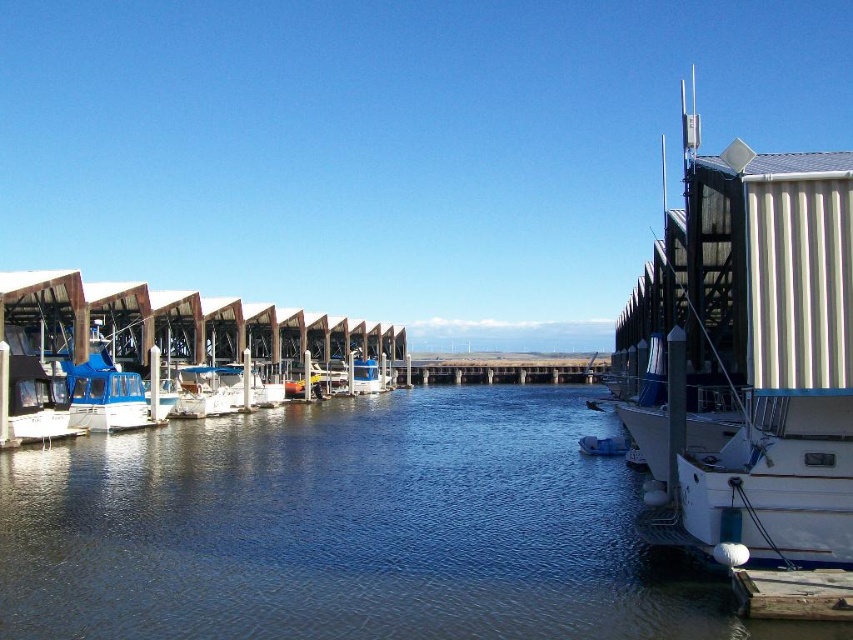
Question: Which point is farther to the camera?

Choices:
 (A) (512, 368)
 (B) (614, 442)
 (C) (537, 513)
 (D) (846, 218)

Answer: (A)

Question: Does blue water at center appear on the left side of blue glossy boat at left?

Choices:
 (A) yes
 (B) no

Answer: (B)

Question: Can you confirm if blue water at center is positioned below blue matte boat at center?

Choices:
 (A) yes
 (B) no

Answer: (A)

Question: Which is nearer to the blue glossy boat at left?

Choices:
 (A) white corrugated metal boat at right
 (B) blue water at center
 (C) blue matte boat at center
 (D) wooden dock at lower right

Answer: (B)

Question: Based on their relative distances, which object is farther from the wooden dock at lower right?

Choices:
 (A) concrete at center
 (B) blue matte boat at center
 (C) white corrugated metal boat at right
 (D) blue glossy boat at left

Answer: (A)

Question: Is blue water at center to the right of wooden dock at lower right from the viewer's perspective?

Choices:
 (A) no
 (B) yes

Answer: (A)